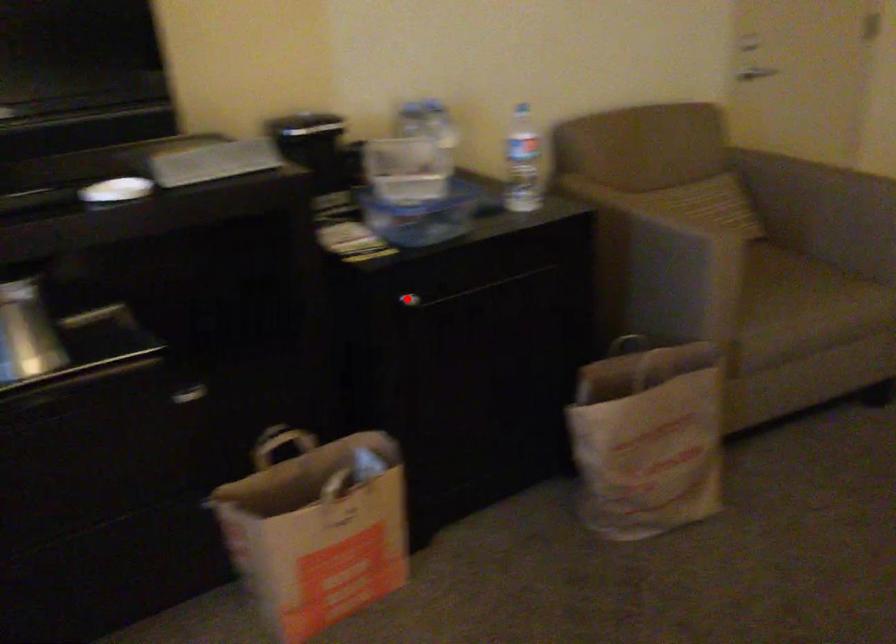
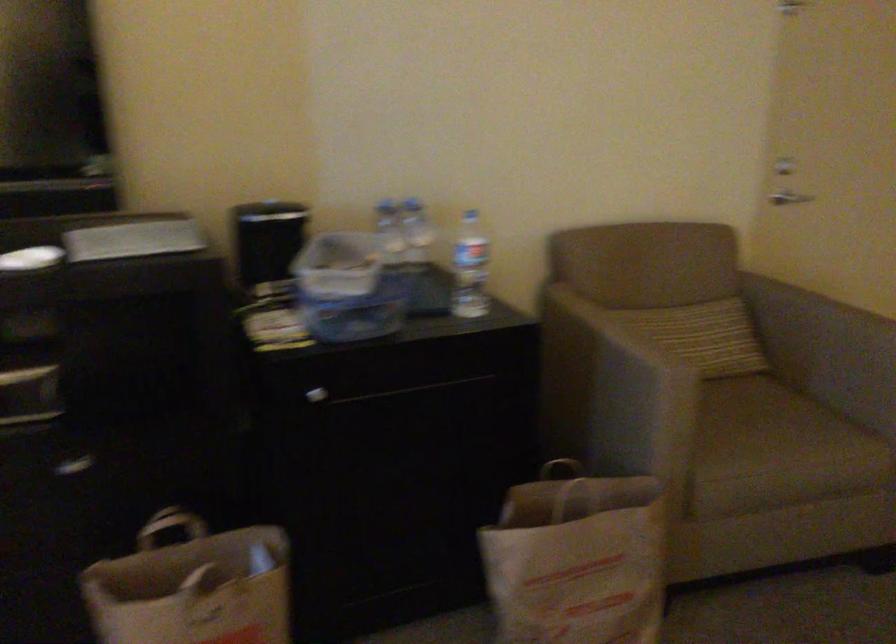
Find the pixel in the second image that matches the highlighted location in the first image.

(316, 395)